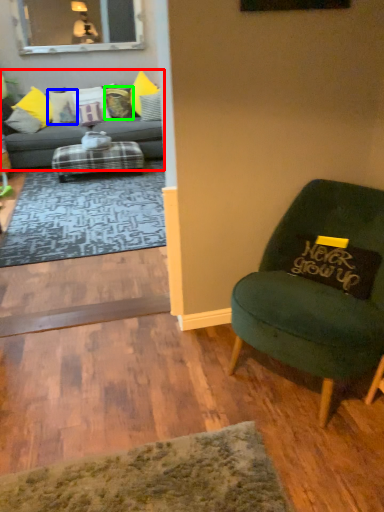
Question: Estimate the real-world distances between objects in this image. Which object is closer to studio couch (highlighted by a red box), pillow (highlighted by a blue box) or pillow (highlighted by a green box)?

Choices:
 (A) pillow
 (B) pillow

Answer: (A)